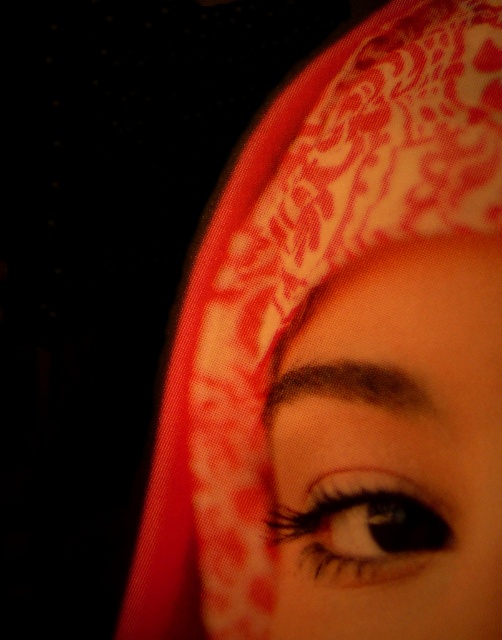
You are an artist trying to sketch this face. You want to draw the point at point (397,628) and point (340,570). Which point should you draw first to ensure proper layering?

Point (397,628) should be drawn first because it is in front of point (340,570), so it needs to be layered on top.

Looking at the person in the image, how does the size of the black glossy eye at center compare to the dark brown eyebrow at upper center?

The black glossy eye at center is wider than the dark brown eyebrow at upper center.